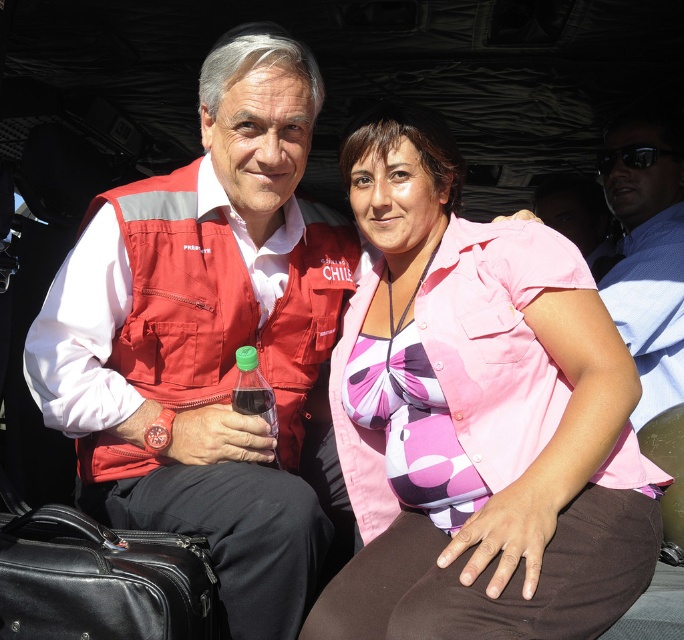
Does blue shirt at upper right appear on the left side of green plastic bottle at center?

Incorrect, blue shirt at upper right is not on the left side of green plastic bottle at center.

Is blue shirt at upper right above green plastic bottle at center?

Yes.

Locate an element on the screen. blue shirt at upper right is located at coordinates (646, 253).

Find the location of a particular element. blue shirt at upper right is located at coordinates (646, 253).

Is black leather suitcase at lower left further to the viewer compared to green plastic bottle at center?

No, black leather suitcase at lower left is in front of green plastic bottle at center.

Does black leather suitcase at lower left have a greater height compared to green plastic bottle at center?

No, black leather suitcase at lower left is not taller than green plastic bottle at center.

Does point (88, 552) come in front of point (254, 390)?

Yes.

Identify the location of black leather suitcase at lower left. (101, 580).

Who is shorter, pink fabric shirt at center or matte red vest at center?

pink fabric shirt at center is shorter.

Is pink fabric shirt at center wider than matte red vest at center?

Incorrect, pink fabric shirt at center's width does not surpass matte red vest at center's.

Does point (601, 440) come behind point (249, 163)?

No.

Where is `pink fabric shirt at center`? The width and height of the screenshot is (684, 640). pink fabric shirt at center is located at coordinates (477, 417).